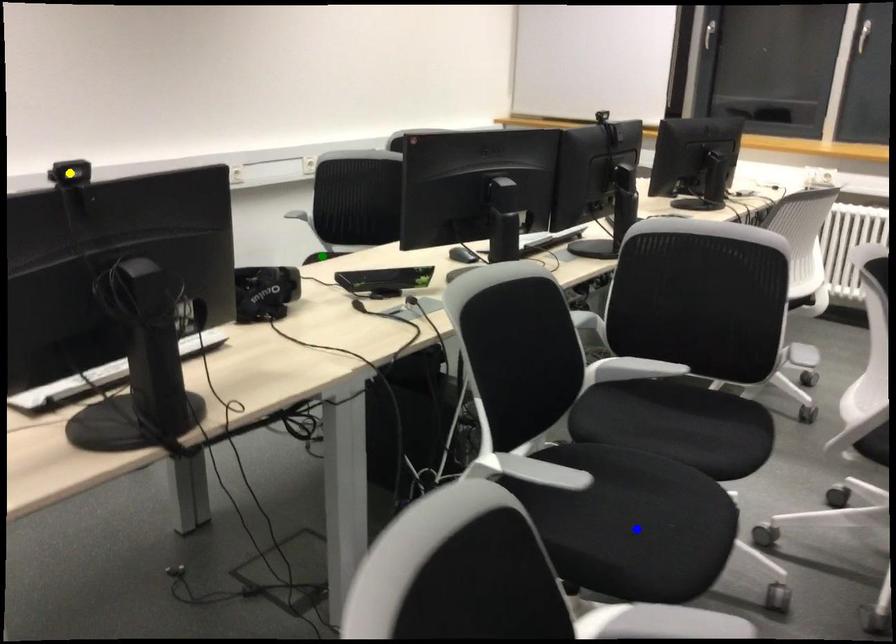
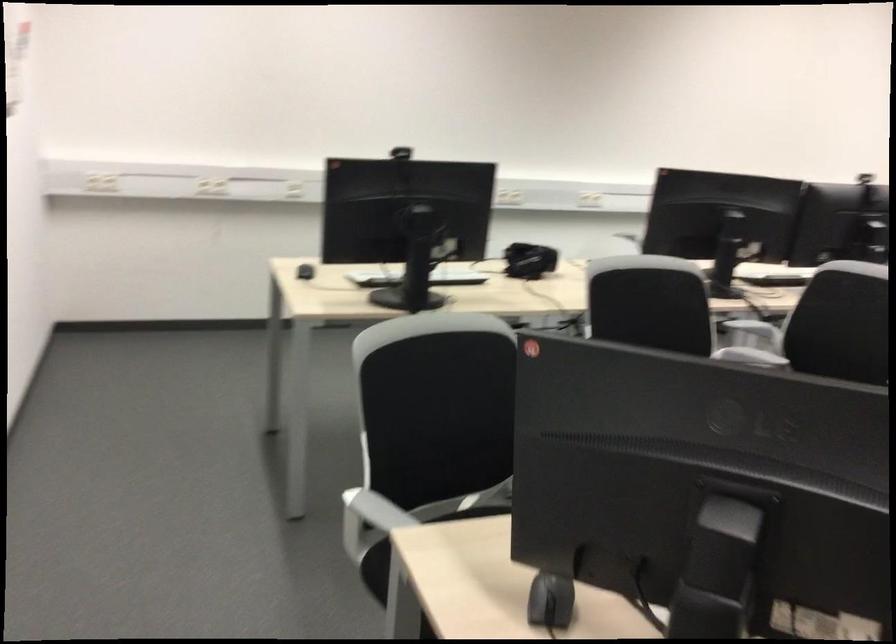
I am providing you with two images of the same scene from different viewpoints. Three points are marked in image1. Which point corresponds to a part or object that is occluded in image2?In image1, three points are marked. Which of them correspond to a part or object that is occluded in image2?Among the three points shown in image1, which one corresponds to a part or object that is no longer visible due to occlusion in image2?

green point, yellow point, blue point cannot be seen in image2.